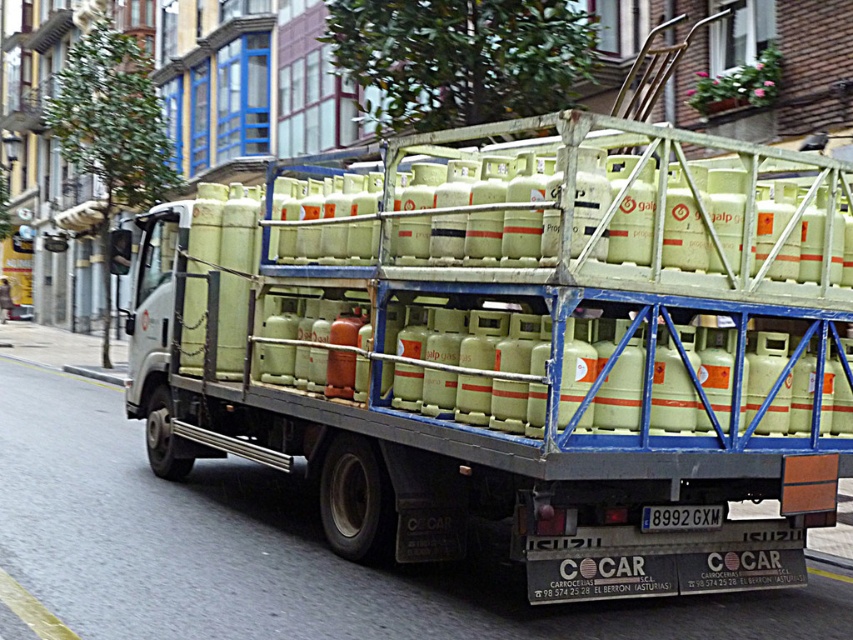
Does point (785, 280) lie in front of point (709, 525)?

Yes, point (785, 280) is closer to viewer.

Which is behind, point (213, 188) or point (701, 516)?

Positioned behind is point (213, 188).

At what (x,y) coordinates should I click in order to perform the action: click on matte green gas canisters at center. Please return your answer as a coordinate pair (x, y). This screenshot has width=853, height=640. Looking at the image, I should click on (509, 356).